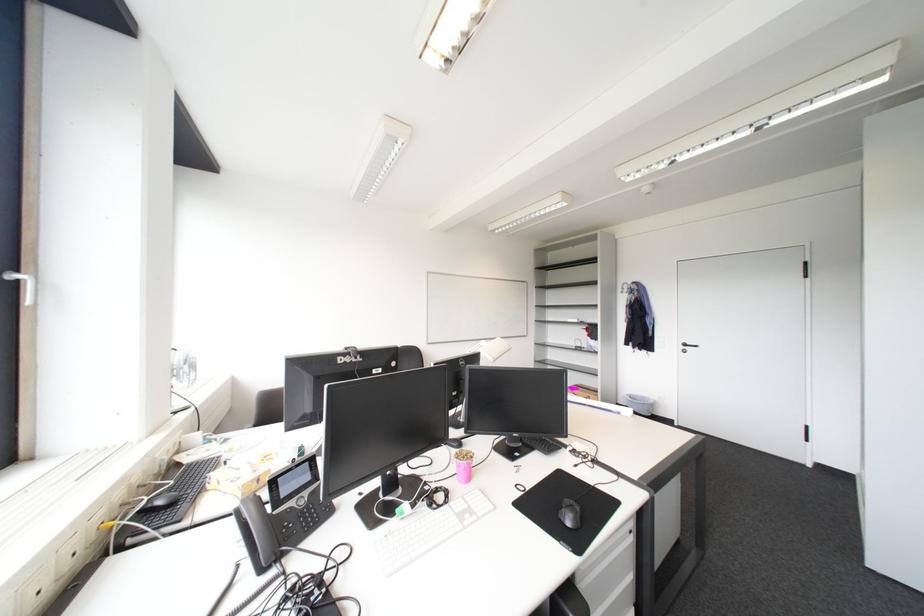
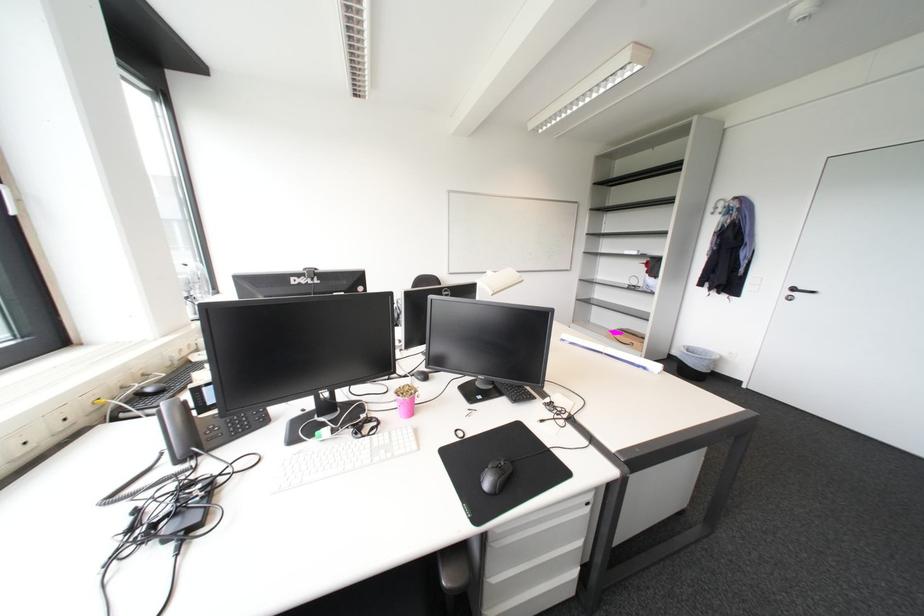
In the second image, find the point that corresponds to (578,524) in the first image.

(496, 485)